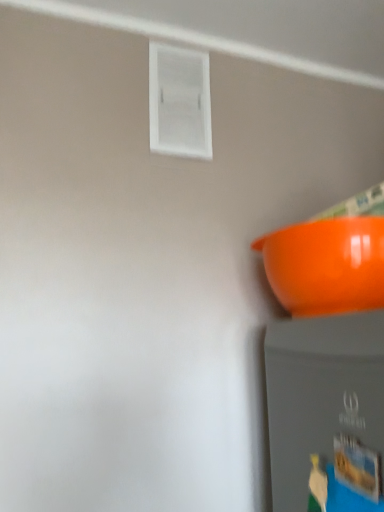
Question: From a real-world perspective, is glossy plastic bowl at right physically located above or below white plastic window at upper center?

Choices:
 (A) below
 (B) above

Answer: (A)

Question: In terms of size, does glossy plastic bowl at right appear bigger or smaller than white plastic window at upper center?

Choices:
 (A) small
 (B) big

Answer: (B)

Question: From the image's perspective, relative to white plastic window at upper center, is glossy plastic bowl at right above or below?

Choices:
 (A) above
 (B) below

Answer: (B)

Question: Considering their positions, is white plastic window at upper center located in front of or behind glossy plastic bowl at right?

Choices:
 (A) front
 (B) behind

Answer: (B)

Question: Considering the positions of white plastic window at upper center and glossy plastic bowl at right in the image, is white plastic window at upper center wider or thinner than glossy plastic bowl at right?

Choices:
 (A) thin
 (B) wide

Answer: (A)

Question: Is white plastic window at upper center to the left or to the right of glossy plastic bowl at right in the image?

Choices:
 (A) left
 (B) right

Answer: (A)

Question: Does point (210, 135) appear closer or farther from the camera than point (344, 236)?

Choices:
 (A) closer
 (B) farther

Answer: (B)